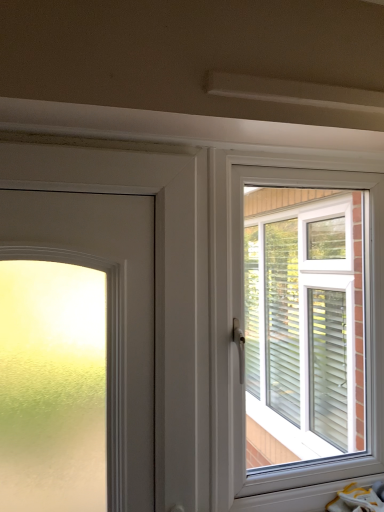
The image size is (384, 512). I want to click on white plastic window at upper right, so click(x=308, y=330).

What do you see at coordinates (308, 330) in the screenshot?
I see `white plastic window at upper right` at bounding box center [308, 330].

Locate an element on the screen. This screenshot has height=512, width=384. white plastic window at upper right is located at coordinates (308, 330).